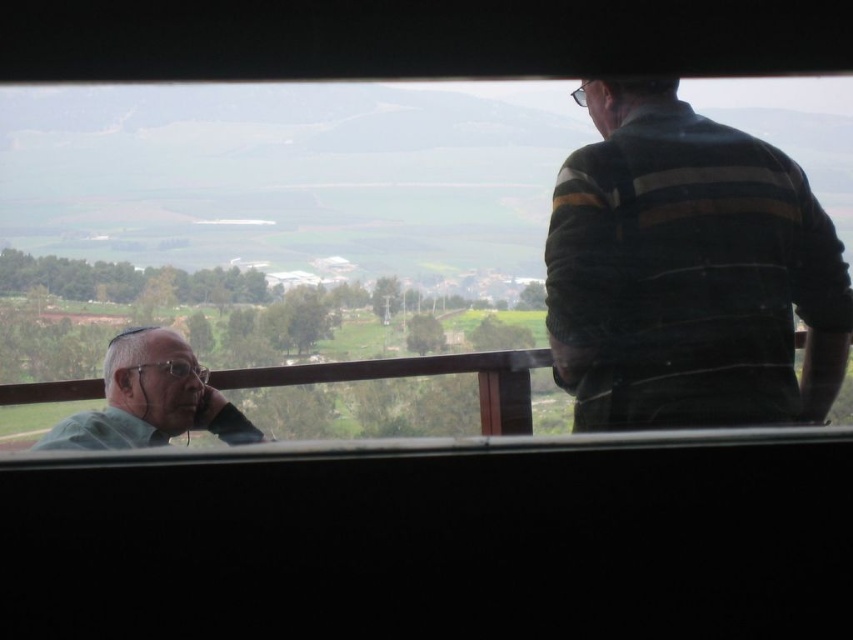
Does striped sweater at right appear over green matte shirt at left?

Yes, striped sweater at right is above green matte shirt at left.

Is point (595, 310) positioned before point (149, 369)?

No.

Which is in front, point (715, 420) or point (183, 372)?

Point (715, 420) is in front.

The height and width of the screenshot is (640, 853). What are the coordinates of `striped sweater at right` in the screenshot? It's located at (688, 272).

Who is positioned more to the left, transparent glass window at center or striped sweater at right?

transparent glass window at center is more to the left.

Can you confirm if transparent glass window at center is wider than striped sweater at right?

Indeed, transparent glass window at center has a greater width compared to striped sweater at right.

Who is more distant from viewer, (357, 250) or (756, 252)?

The point (357, 250) is behind.

Where is `transparent glass window at center`? The width and height of the screenshot is (853, 640). transparent glass window at center is located at coordinates (556, 236).

Which is in front, point (750, 264) or point (195, 365)?

Point (750, 264)

Where is `transparent glass window at center`? Image resolution: width=853 pixels, height=640 pixels. transparent glass window at center is located at coordinates (556, 236).